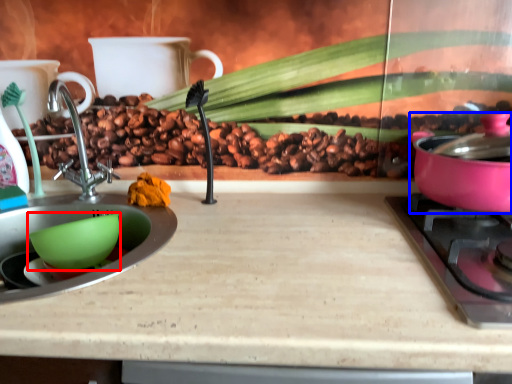
Question: Which object is closer to the camera taking this photo, mixing bowl (highlighted by a red box) or kitchen appliance (highlighted by a blue box)?

Choices:
 (A) mixing bowl
 (B) kitchen appliance

Answer: (B)